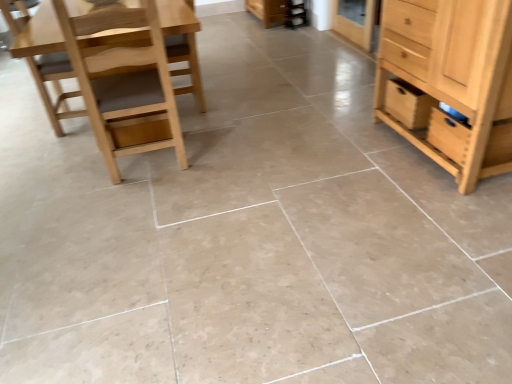
Question: From the image's perspective, would you say natural wood cabinet at right is shown under light brown wood chair at left, the first chair viewed from the right?

Choices:
 (A) yes
 (B) no

Answer: (B)

Question: Would you say natural wood cabinet at right is outside light brown wood chair at left, marked as the 2th chair in a left-to-right arrangement?

Choices:
 (A) no
 (B) yes

Answer: (B)

Question: From a real-world perspective, is natural wood cabinet at right physically below light brown wood chair at left, marked as the 2th chair in a left-to-right arrangement?

Choices:
 (A) yes
 (B) no

Answer: (A)

Question: Does natural wood cabinet at right have a greater height compared to light brown wood chair at left, marked as the 2th chair in a left-to-right arrangement?

Choices:
 (A) no
 (B) yes

Answer: (A)

Question: Is natural wood cabinet at right wider than light brown wood chair at left, the first chair viewed from the right?

Choices:
 (A) no
 (B) yes

Answer: (B)

Question: Visually, is wooden drawer at right positioned to the left or to the right of light brown wood chair at left, marked as the 2th chair in a left-to-right arrangement?

Choices:
 (A) left
 (B) right

Answer: (B)

Question: From their relative heights in the image, would you say wooden drawer at right is taller or shorter than light brown wood chair at left, the first chair viewed from the right?

Choices:
 (A) tall
 (B) short

Answer: (B)

Question: Does point (432, 105) appear closer or farther from the camera than point (153, 102)?

Choices:
 (A) farther
 (B) closer

Answer: (A)

Question: Is wooden drawer at right wider or thinner than light brown wood chair at left, the first chair viewed from the right?

Choices:
 (A) wide
 (B) thin

Answer: (B)

Question: Would you say wooden drawer at right is inside or outside natural wood cabinet at right?

Choices:
 (A) inside
 (B) outside

Answer: (A)

Question: In the image, is wooden drawer at right positioned in front of or behind natural wood cabinet at right?

Choices:
 (A) front
 (B) behind

Answer: (B)

Question: From the image's perspective, relative to natural wood cabinet at right, is wooden drawer at right above or below?

Choices:
 (A) below
 (B) above

Answer: (A)

Question: Considering the positions of point (409, 127) and point (460, 152), is point (409, 127) closer or farther from the camera than point (460, 152)?

Choices:
 (A) closer
 (B) farther

Answer: (B)

Question: From the image's perspective, relative to light brown wood chair at left, marked as the second chair in a right-to-left arrangement, is wooden drawer at right above or below?

Choices:
 (A) below
 (B) above

Answer: (A)

Question: Based on their sizes in the image, would you say wooden drawer at right is bigger or smaller than light brown wood chair at left, acting as the 1th chair starting from the left?

Choices:
 (A) small
 (B) big

Answer: (A)